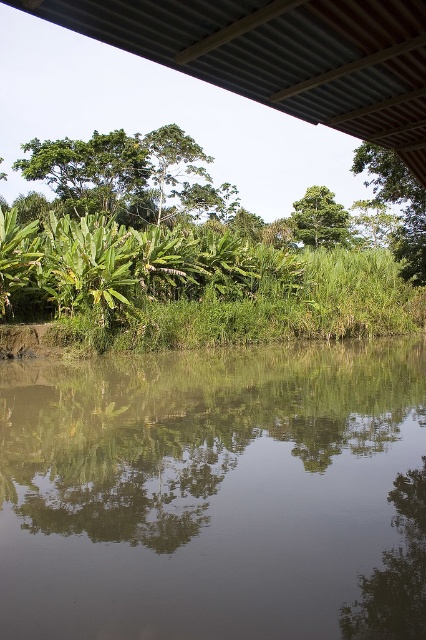
Question: Can you confirm if green leafy tree at upper left is thinner than green leafy tree at upper right?

Choices:
 (A) yes
 (B) no

Answer: (B)

Question: Among these points, which one is farthest from the camera?

Choices:
 (A) (321, 214)
 (B) (198, 552)

Answer: (A)

Question: Can you confirm if green leafy plants at center is positioned below green leafy tree at center?

Choices:
 (A) no
 (B) yes

Answer: (B)

Question: Which point is farther to the camera?

Choices:
 (A) (305, 196)
 (B) (388, 189)

Answer: (A)

Question: Does metallic corrugated roof at upper center have a lesser width compared to green leafy tree at upper right?

Choices:
 (A) yes
 (B) no

Answer: (A)

Question: Which object is the farthest from the green leafy tree at center?

Choices:
 (A) green leafy tree at upper right
 (B) green reflective water at center
 (C) green leafy tree at upper left
 (D) green leafy plants at center

Answer: (B)